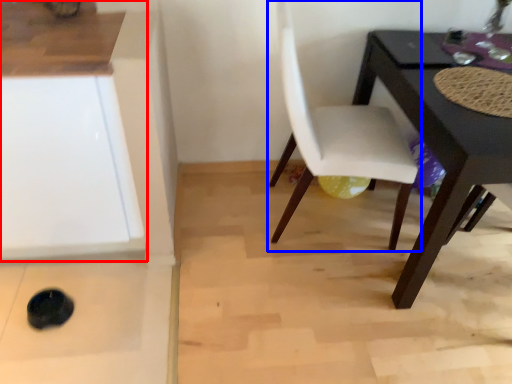
Question: Which point is closer to the camera, cabinetry (highlighted by a red box) or chair (highlighted by a blue box)?

Choices:
 (A) cabinetry
 (B) chair

Answer: (A)